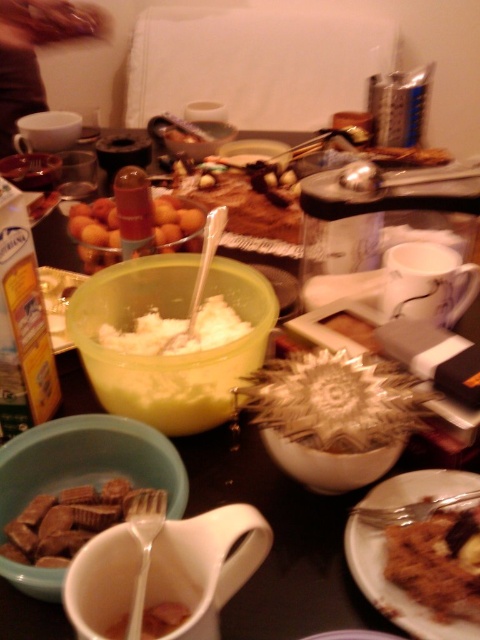
Question: Which point appears farthest from the camera in this image?

Choices:
 (A) (64, 122)
 (B) (122, 472)

Answer: (A)

Question: Can you confirm if white creamy substance at center is positioned to the right of brown matte peanut at lower left?

Choices:
 (A) yes
 (B) no

Answer: (B)

Question: Estimate the real-world distances between objects in this image. Which object is closer to the green plastic bowl at center?

Choices:
 (A) white matte cup at lower center
 (B) translucent plastic bowl at center
 (C) translucent plastic bowl at upper left

Answer: (A)

Question: Observing the image, what is the correct spatial positioning of green plastic bowl at center in reference to white creamy substance at center?

Choices:
 (A) right
 (B) left

Answer: (A)

Question: Can you confirm if brown crumbly cake at center is wider than translucent plastic bowl at center?

Choices:
 (A) yes
 (B) no

Answer: (B)

Question: Which object is closer to the camera taking this photo?

Choices:
 (A) matte plastic bowl at lower left
 (B) white matte cup at lower center

Answer: (B)